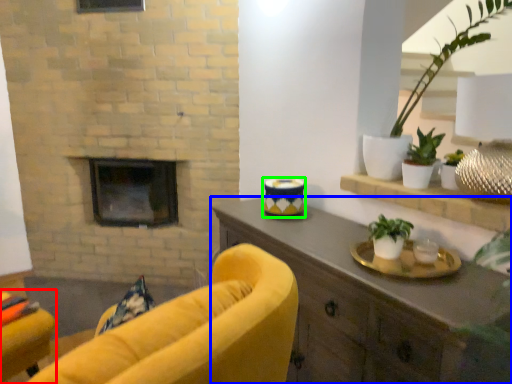
Question: Which object is the closest to the chair (highlighted by a red box)? Choose among these: cabinetry (highlighted by a blue box) or candle holder (highlighted by a green box).

Choices:
 (A) cabinetry
 (B) candle holder

Answer: (A)